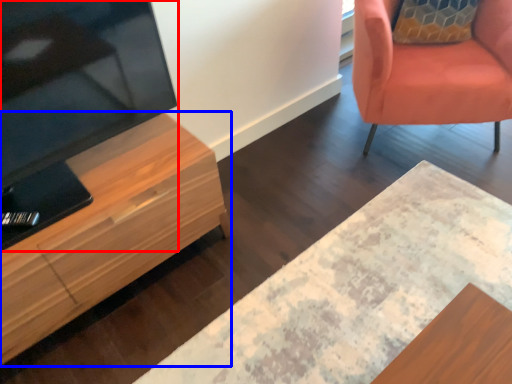
Question: Among these objects, which one is farthest to the camera, television (highlighted by a red box) or cabinetry (highlighted by a blue box)?

Choices:
 (A) television
 (B) cabinetry

Answer: (B)